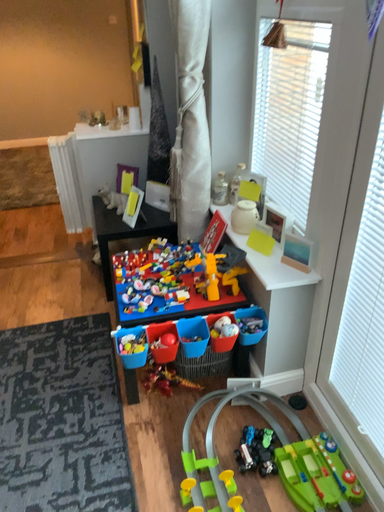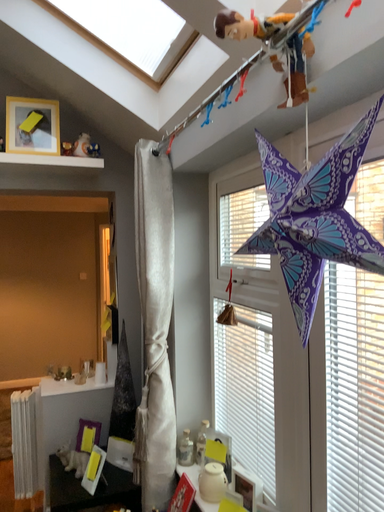
Question: How did the camera likely rotate when shooting the video?

Choices:
 (A) rotated upward
 (B) rotated downward

Answer: (A)